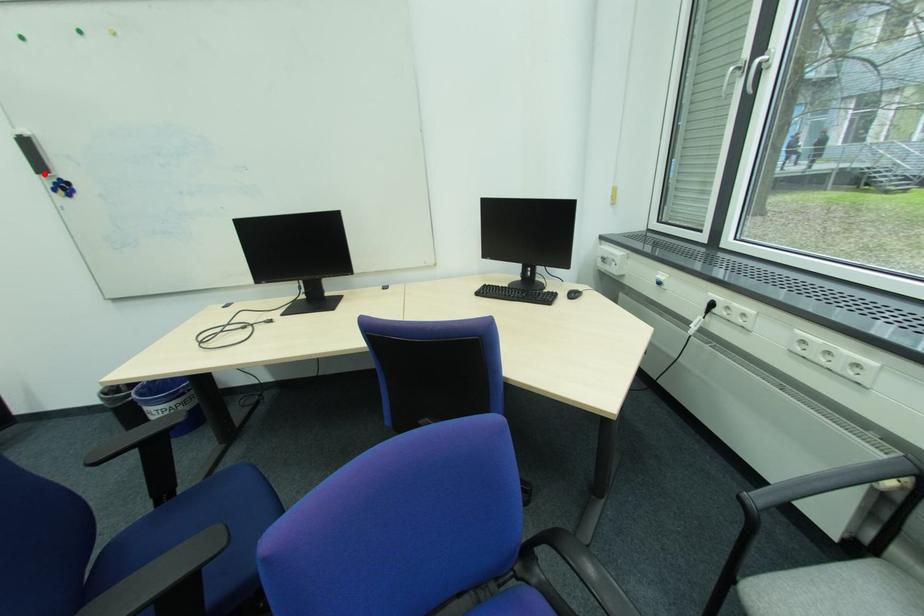
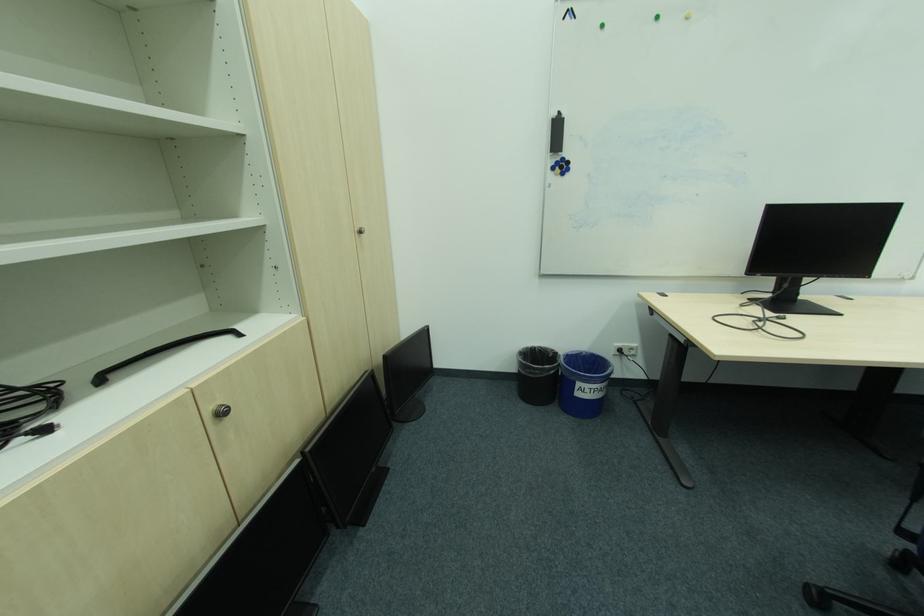
Locate, in the second image, the point that corresponds to the highlighted location in the first image.

(558, 152)